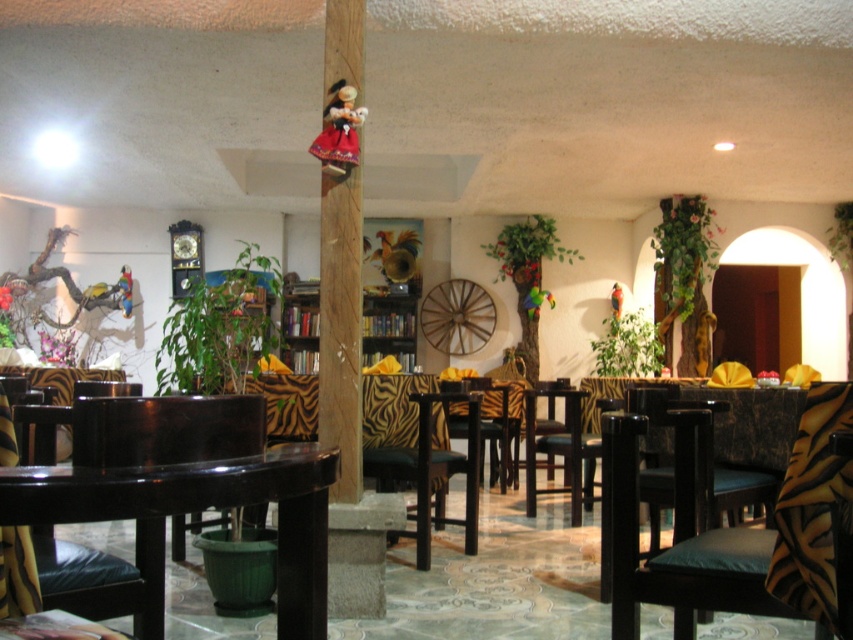
Question: Which of the following is the farthest from the observer?

Choices:
 (A) (490, 390)
 (B) (607, 588)

Answer: (A)

Question: Can you confirm if glossy wood armchair at center is wider than dark brown leather armchair at center?

Choices:
 (A) yes
 (B) no

Answer: (B)

Question: Is glossy black table at lower left behind zebra-patterned fabric armchair at center?

Choices:
 (A) yes
 (B) no

Answer: (B)

Question: Is glossy wood armchair at center smaller than wooden chair at center?

Choices:
 (A) no
 (B) yes

Answer: (B)

Question: Which object is positioned closest to the wooden chair at center?

Choices:
 (A) glossy black table at lower left
 (B) zebra-patterned fabric armchair at center
 (C) glossy wood armchair at center
 (D) dark wood chair with cushion at center

Answer: (B)

Question: Which object appears closest to the camera in this image?

Choices:
 (A) zebra-patterned fabric at center
 (B) dark brown leather armchair at center
 (C) glossy black table at lower left

Answer: (C)